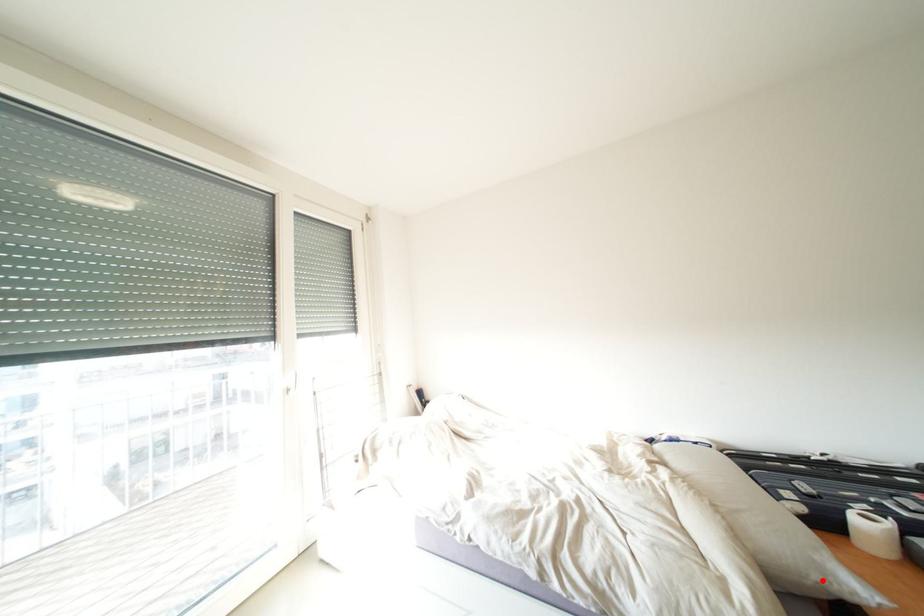
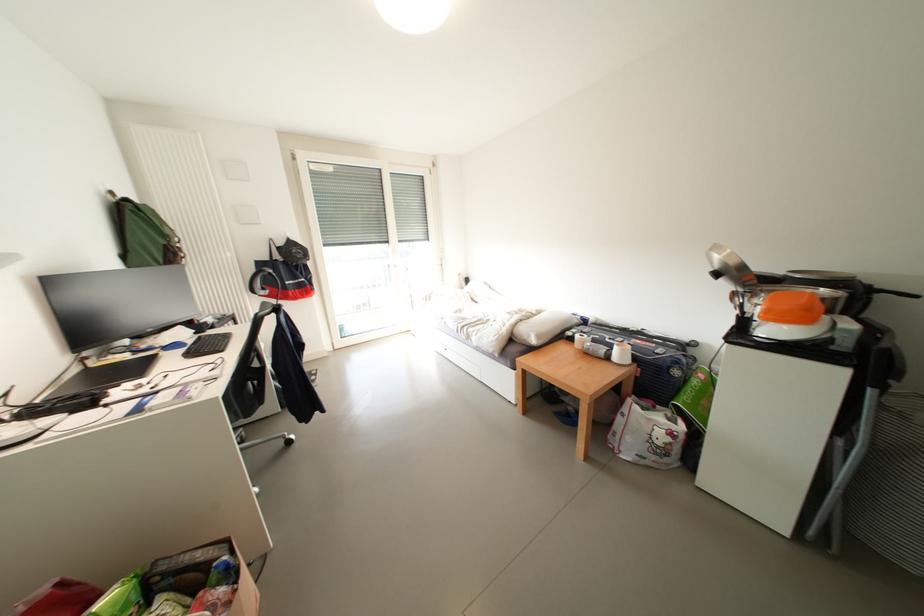
Question: A red point is marked in image1. In image2, is the corresponding 3D point closer to the camera or farther? Reply with the corresponding letter.

Choices:
 (A) The corresponding 3D point is closer.
 (B) The corresponding 3D point is farther.

Answer: (B)